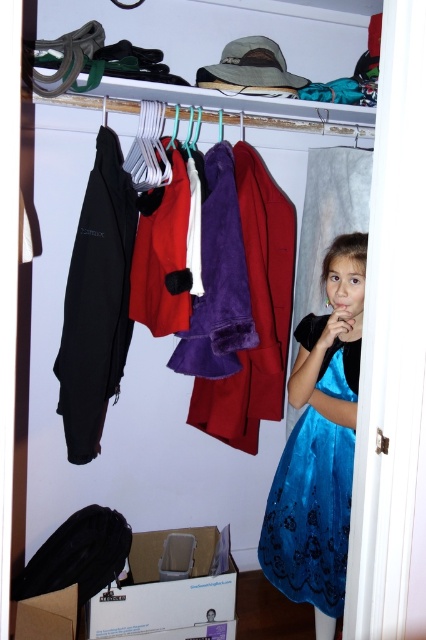
You are organizing a fashion show and need to place the velvet blue dress at lower right and the matte black jacket at left in the same display case. Based on their positions in the closet, which item is closer to the right side of the display case?

The velvet blue dress at lower right is closer to the right side of the display case because it is positioned to the right of the matte black jacket at left in the closet.

You are standing at the point marked by the coordinate point at point (279, 513). You want to reach the closet door which is 6.17 feet away. Is there enough space for you to move freely towards the door?

The distance between you and the closet door is 6.17 feet, so there is enough space for you to move freely towards the door.

Based on the photo, you are trying to decide whether to wear the velvet blue dress at lower right or the matte black jacket at left for an event. Based on their widths, which one would you choose if you prefer a wider garment?

The velvet blue dress at lower right is wider than the matte black jacket at left, so you should choose the velvet blue dress at lower right if you prefer a wider garment.